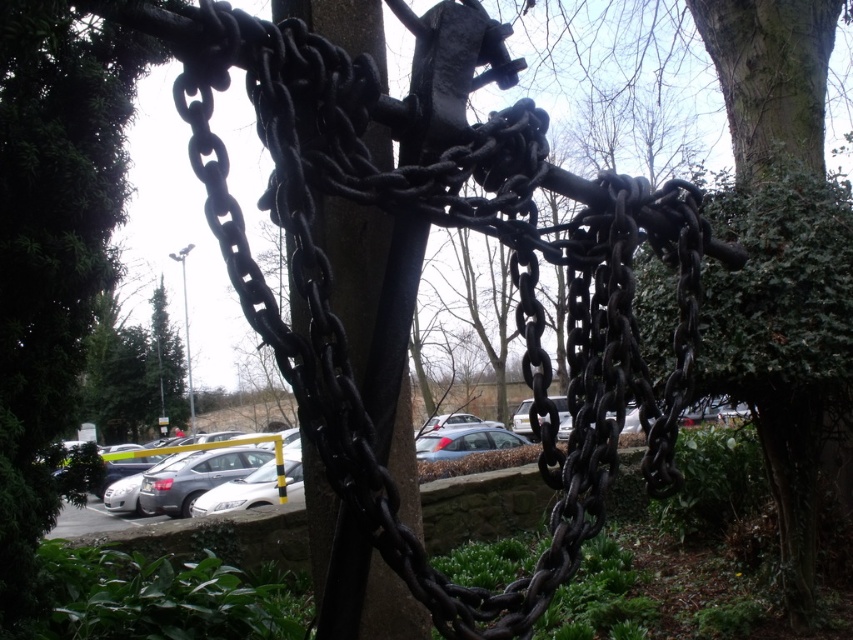
You are standing in the parking lot and see the black metal pole at center and the silver metallic car at center. Which object is positioned to the right side from your perspective?

The black metal pole at center is to the right of the silver metallic car at center, so the black metal pole at center is positioned to the right side.

You are a painter standing at the edge of the parking lot. You need to paint the black metal pole at center and the silver metallic car at center. Which object should you paint first if you want to start with the taller one?

The silver metallic car at center is taller than the black metal pole at center, so you should paint the silver metallic car at center first.